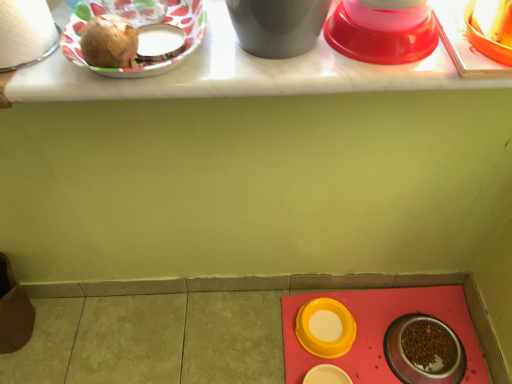
What do you see at coordinates (240, 74) in the screenshot? I see `matte white table at upper center` at bounding box center [240, 74].

Locate an element on the screen. The width and height of the screenshot is (512, 384). shiny brown onion at upper left is located at coordinates (109, 42).

Image resolution: width=512 pixels, height=384 pixels. I want to click on white matte toilet paper at upper left, so click(25, 33).

This screenshot has width=512, height=384. In order to click on metallic silver bowl at lower right, which ranks as the 5th tableware in top-to-bottom order in this screenshot , I will do `click(424, 350)`.

This screenshot has width=512, height=384. Find the location of `matte plastic plate at upper left, the fourth tableware viewed from the back`. matte plastic plate at upper left, the fourth tableware viewed from the back is located at coordinates (160, 42).

What do you see at coordinates (160, 42) in the screenshot?
I see `matte plastic plate at upper left, which appears as the 2th tableware when viewed from the left` at bounding box center [160, 42].

The width and height of the screenshot is (512, 384). In order to click on matte white table at upper center in this screenshot , I will do `click(240, 74)`.

Is matte white table at upper center positioned with its back to yellow matte bowl at lower center, the 1th tableware when ordered from bottom to top?

matte white table at upper center is not turned away from yellow matte bowl at lower center, the 1th tableware when ordered from bottom to top.

Is point (29, 70) positioned behind point (327, 366)?

No, (29, 70) is in front of (327, 366).

Between matte white table at upper center and yellow matte bowl at lower center, which is the third tableware from left to right, which one is positioned in front?

matte white table at upper center.

Who is taller, matte white table at upper center or yellow matte bowl at lower center, which is the 6th tableware in top-to-bottom order?

Standing taller between the two is yellow matte bowl at lower center, which is the 6th tableware in top-to-bottom order.

Considering the points (226, 21) and (13, 3), which point is behind, point (226, 21) or point (13, 3)?

The point (226, 21) is more distant.

From the image's perspective, is matte white table at upper center beneath white matte toilet paper at upper left?

Yes, from the image's perspective, matte white table at upper center is below white matte toilet paper at upper left.

Considering the relative sizes of matte white table at upper center and white matte toilet paper at upper left in the image provided, is matte white table at upper center bigger than white matte toilet paper at upper left?

Correct, matte white table at upper center is larger in size than white matte toilet paper at upper left.

Is metallic silver bowl at lower right, which is the second tableware from bottom to top, oriented towards shiny plastic bowl at upper right, the first tableware viewed from the top?

No.

Is metallic silver bowl at lower right, which ranks as the 5th tableware in top-to-bottom order, not within shiny plastic bowl at upper right, the third tableware when ordered from right to left?

Yes, metallic silver bowl at lower right, which ranks as the 5th tableware in top-to-bottom order, is located beyond the bounds of shiny plastic bowl at upper right, the third tableware when ordered from right to left.

Is metallic silver bowl at lower right, which is the second tableware from bottom to top, at the right side of shiny plastic bowl at upper right, which ranks as the fifth tableware in back-to-front order?

Yes.

Is matte plastic plate at upper left, the 3th tableware in the front-to-back sequence, positioned with its back to shiny plastic bowl at upper right, the third tableware when ordered from right to left?

Yes.

Is matte plastic plate at upper left, arranged as the fifth tableware when viewed from the right, to the left or to the right of shiny plastic bowl at upper right, the first tableware viewed from the top, in the image?

From the image, it's evident that matte plastic plate at upper left, arranged as the fifth tableware when viewed from the right, is to the left of shiny plastic bowl at upper right, the first tableware viewed from the top.

Is matte plastic plate at upper left, which is the fourth tableware in bottom-to-top order, closer to the viewer compared to shiny plastic bowl at upper right, which is counted as the second tableware, starting from the front?

No, it is behind shiny plastic bowl at upper right, which is counted as the second tableware, starting from the front.

From the image's perspective, does matte plastic plate at upper left, which is the fourth tableware in bottom-to-top order, appear lower than shiny plastic bowl at upper right, the third tableware when ordered from right to left?

Indeed, from the image's perspective, matte plastic plate at upper left, which is the fourth tableware in bottom-to-top order, is shown beneath shiny plastic bowl at upper right, the third tableware when ordered from right to left.

Would you consider matte plastic plate at upper left, the 3th tableware in the front-to-back sequence, to be distant from white matte toilet paper at upper left?

They are positioned close to each other.

What's the angular difference between matte plastic plate at upper left, arranged as the fifth tableware when viewed from the right, and white matte toilet paper at upper left's facing directions?

They differ by 88.7 degrees in their facing directions.

Based on the photo, from a real-world perspective, relative to white matte toilet paper at upper left, is matte plastic plate at upper left, which appears as the third tableware when viewed from the top, vertically above or below?

Clearly, from a real-world perspective, matte plastic plate at upper left, which appears as the third tableware when viewed from the top, is below white matte toilet paper at upper left.

Between matte plastic plate at upper left, the 3th tableware in the front-to-back sequence, and white matte toilet paper at upper left, which one has larger size?

white matte toilet paper at upper left is bigger.

Which is behind, point (16, 19) or point (458, 369)?

The point (458, 369) is farther from the camera.

Considering the sizes of objects white matte toilet paper at upper left and metallic silver bowl at lower right, which is the second tableware from bottom to top, in the image provided, who is bigger, white matte toilet paper at upper left or metallic silver bowl at lower right, which is the second tableware from bottom to top,?

white matte toilet paper at upper left is bigger.

Are white matte toilet paper at upper left and metallic silver bowl at lower right, marked as the sixth tableware in a left-to-right arrangement, making contact?

They are not placed beside each other.

Based on the photo, could you tell me if matte plastic plate at upper left, arranged as the sixth tableware when viewed from the right, is facing shiny brown onion at upper left?

Yes, matte plastic plate at upper left, arranged as the sixth tableware when viewed from the right, is aimed at shiny brown onion at upper left.

Identify the location of food that is in front of the matte plastic plate at upper left, which is counted as the 1th tableware, starting from the left. (109, 42).

Considering the sizes of objects matte plastic plate at upper left, which is the fifth tableware from bottom to top, and shiny brown onion at upper left in the image provided, who is thinner, matte plastic plate at upper left, which is the fifth tableware from bottom to top, or shiny brown onion at upper left?

Thinner between the two is shiny brown onion at upper left.

Where is `table above the yellow matte bowl at lower center, which is the second tableware from back to front (from the image's perspective)`? table above the yellow matte bowl at lower center, which is the second tableware from back to front (from the image's perspective) is located at coordinates (240, 74).

At what (x,y) coordinates should I click in order to perform the action: click on toilet paper to the left of matte white table at upper center. Please return your answer as a coordinate pair (x, y). Looking at the image, I should click on (25, 33).

Which object lies nearer to the anchor point matte plastic plate at upper left, the fourth tableware viewed from the back, yellow plastic bowl at lower center, placed as the sixth tableware when sorted from front to back, or metallic silver bowl at lower right, which is the second tableware from bottom to top?

yellow plastic bowl at lower center, placed as the sixth tableware when sorted from front to back.

Considering their positions, is metallic silver bowl at lower right, which ranks as the 5th tableware in top-to-bottom order, positioned closer to shiny plastic bowl at upper right, which is counted as the second tableware, starting from the front, than yellow plastic bowl at lower center, which is the 2th tableware from right to left?

Based on the image, yellow plastic bowl at lower center, which is the 2th tableware from right to left, appears to be nearer to shiny plastic bowl at upper right, which is counted as the second tableware, starting from the front.

When comparing their distances from yellow matte bowl at lower center, which is the 5th tableware in front-to-back order, does matte white table at upper center or matte plastic plate at upper left, which is the fifth tableware from bottom to top, seem further?

matte plastic plate at upper left, which is the fifth tableware from bottom to top, is further to yellow matte bowl at lower center, which is the 5th tableware in front-to-back order.

From the image, which object appears to be nearer to yellow matte bowl at lower center, the 4th tableware when ordered from right to left, matte plastic plate at upper left, which is the 6th tableware in back-to-front order, or matte plastic plate at upper left, the 3th tableware in the front-to-back sequence?

matte plastic plate at upper left, the 3th tableware in the front-to-back sequence, is positioned closer to the anchor yellow matte bowl at lower center, the 4th tableware when ordered from right to left.

In the scene shown: Based on their spatial positions, is yellow matte bowl at lower center, the 1th tableware when ordered from bottom to top, or shiny plastic bowl at upper right, the 6th tableware ordered from the bottom, further from metallic silver bowl at lower right, the fourth tableware when ordered from front to back?

shiny plastic bowl at upper right, the 6th tableware ordered from the bottom, lies further to metallic silver bowl at lower right, the fourth tableware when ordered from front to back, than the other object.

When comparing their distances from white matte toilet paper at upper left, does matte plastic plate at upper left, placed as the 1th tableware when sorted from front to back, or shiny brown onion at upper left seem further?

The object further to white matte toilet paper at upper left is matte plastic plate at upper left, placed as the 1th tableware when sorted from front to back.

Estimate the real-world distances between objects in this image. Which object is closer to shiny brown onion at upper left, yellow plastic bowl at lower center, the first tableware from the back, or matte plastic plate at upper left, which ranks as the 2th tableware in top-to-bottom order?

matte plastic plate at upper left, which ranks as the 2th tableware in top-to-bottom order, lies closer to shiny brown onion at upper left than the other object.

When comparing their distances from shiny plastic bowl at upper right, which is counted as the second tableware, starting from the front, does yellow matte bowl at lower center, which is the third tableware from left to right, or shiny brown onion at upper left seem further?

yellow matte bowl at lower center, which is the third tableware from left to right, is further to shiny plastic bowl at upper right, which is counted as the second tableware, starting from the front.

Image resolution: width=512 pixels, height=384 pixels. In order to click on food that lies between matte plastic plate at upper left, which is the 6th tableware in back-to-front order, and yellow matte bowl at lower center, which is the 5th tableware in front-to-back order, from top to bottom in this screenshot , I will do `click(109, 42)`.

This screenshot has height=384, width=512. What are the coordinates of `table located between white matte toilet paper at upper left and yellow plastic bowl at lower center, placed as the sixth tableware when sorted from front to back, in the depth direction` in the screenshot? It's located at (240, 74).

Find the location of `table between white matte toilet paper at upper left and metallic silver bowl at lower right, which ranks as the 5th tableware in top-to-bottom order, from top to bottom`. table between white matte toilet paper at upper left and metallic silver bowl at lower right, which ranks as the 5th tableware in top-to-bottom order, from top to bottom is located at coordinates (240, 74).

Where is `food between white matte toilet paper at upper left and yellow plastic bowl at lower center, which is the fifth tableware in left-to-right order, from front to back`? The image size is (512, 384). food between white matte toilet paper at upper left and yellow plastic bowl at lower center, which is the fifth tableware in left-to-right order, from front to back is located at coordinates (109, 42).